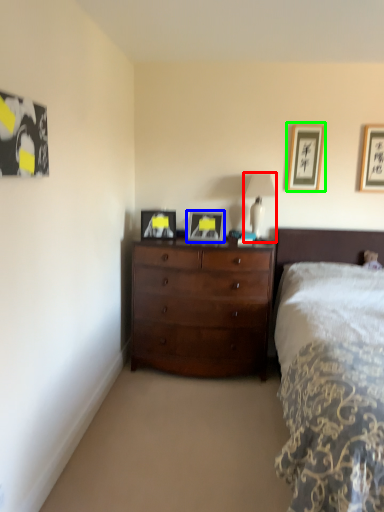
Question: Considering the real-world distances, which object is closest to table lamp (highlighted by a red box)? picture frame (highlighted by a blue box) or picture frame (highlighted by a green box).

Choices:
 (A) picture frame
 (B) picture frame

Answer: (B)